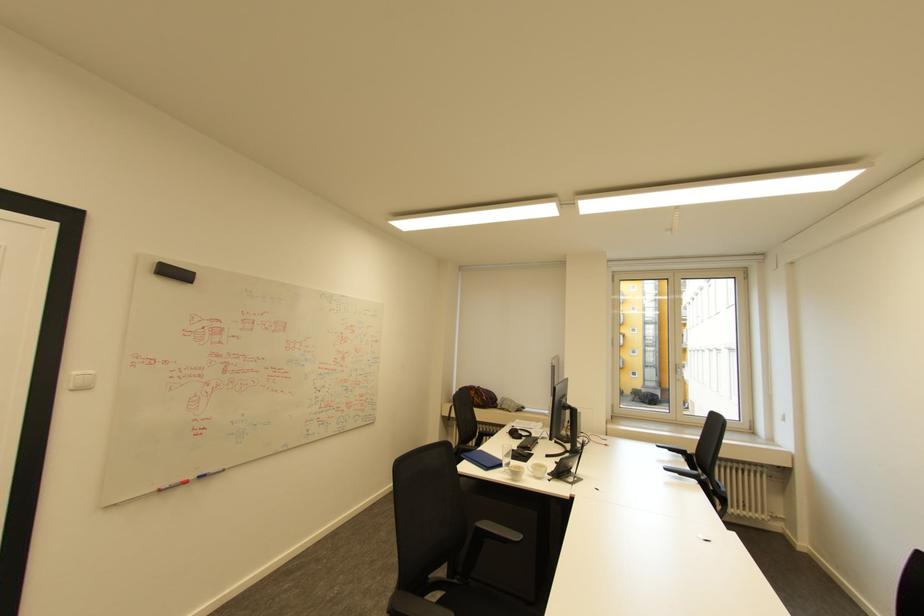
Where is `white window handle`? white window handle is located at coordinates (673, 379).